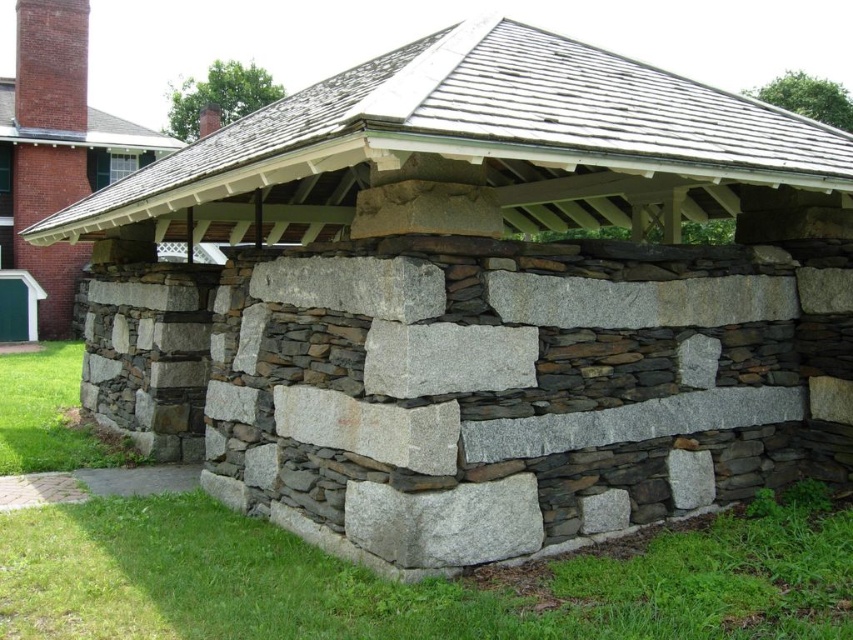
Does point (440, 99) lie behind point (4, 141)?

No, it is in front of (4, 141).

Is gray stone wall at lower left positioned at the back of natural stone wall at lower left?

No.

In order to click on gray stone wall at lower left in this screenshot , I will do `click(476, 145)`.

Looking at this image, measure the distance between point (178, 532) and camera.

Point (178, 532) and camera are 19.33 feet apart.

Find the location of a particular element. Image resolution: width=853 pixels, height=640 pixels. green grass at lower center is located at coordinates click(419, 582).

Locate an element on the screen. green grass at lower center is located at coordinates (419, 582).

Based on the photo, which of these two, gray stone wall at lower left or green grass at lower center, stands shorter?

green grass at lower center is shorter.

Which is in front, point (547, 204) or point (173, 582)?

Point (173, 582) is more forward.

Find the location of a particular element. Image resolution: width=853 pixels, height=640 pixels. gray stone wall at lower left is located at coordinates (476, 145).